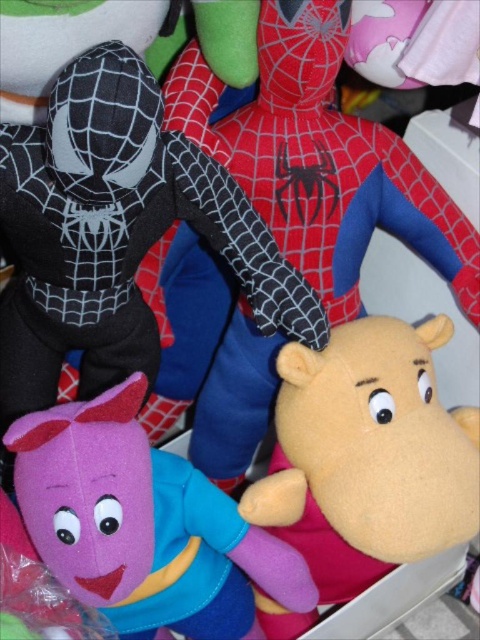
Does soft yellow hippo at center appear under matte purple plush toy at lower left?

No, soft yellow hippo at center is not below matte purple plush toy at lower left.

Is soft yellow hippo at center bigger than matte purple plush toy at lower left?

Correct, soft yellow hippo at center is larger in size than matte purple plush toy at lower left.

Image resolution: width=480 pixels, height=640 pixels. In order to click on soft yellow hippo at center in this screenshot , I will do `click(368, 456)`.

Based on the photo, who is more forward, (241, 378) or (313, 198)?

Positioned in front is point (313, 198).

The width and height of the screenshot is (480, 640). I want to click on velvet yellow plush hippo at center, so click(328, 150).

Which is in front, point (408, 148) or point (325, 168)?

Point (325, 168)

This screenshot has height=640, width=480. Identify the location of velvet yellow plush hippo at center. (328, 150).

In the scene shown: Is velvet yellow plush hippo at center below matte purple plush toy at lower left?

Actually, velvet yellow plush hippo at center is above matte purple plush toy at lower left.

This screenshot has width=480, height=640. What do you see at coordinates (328, 150) in the screenshot?
I see `velvet yellow plush hippo at center` at bounding box center [328, 150].

Where is `velvet yellow plush hippo at center`? velvet yellow plush hippo at center is located at coordinates (328, 150).